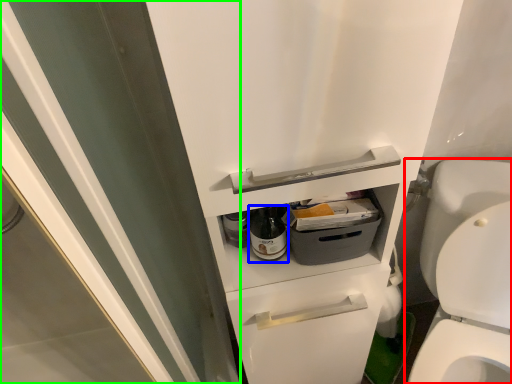
Question: Estimate the real-world distances between objects in this image. Which object is closer to toilet (highlighted by a red box), bottle (highlighted by a blue box) or screen door (highlighted by a green box)?

Choices:
 (A) bottle
 (B) screen door

Answer: (A)